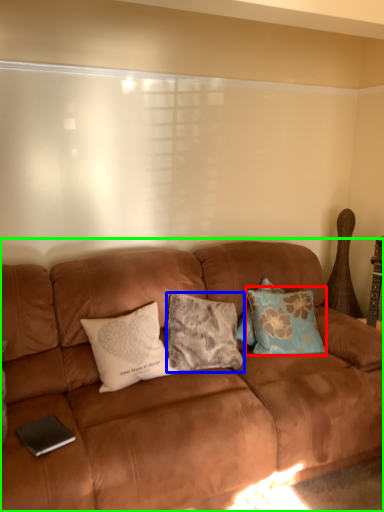
Question: Based on their relative distances, which object is farther from pillow (highlighted by a red box)? Choose from pillow (highlighted by a blue box) and studio couch (highlighted by a green box).

Choices:
 (A) pillow
 (B) studio couch

Answer: (B)